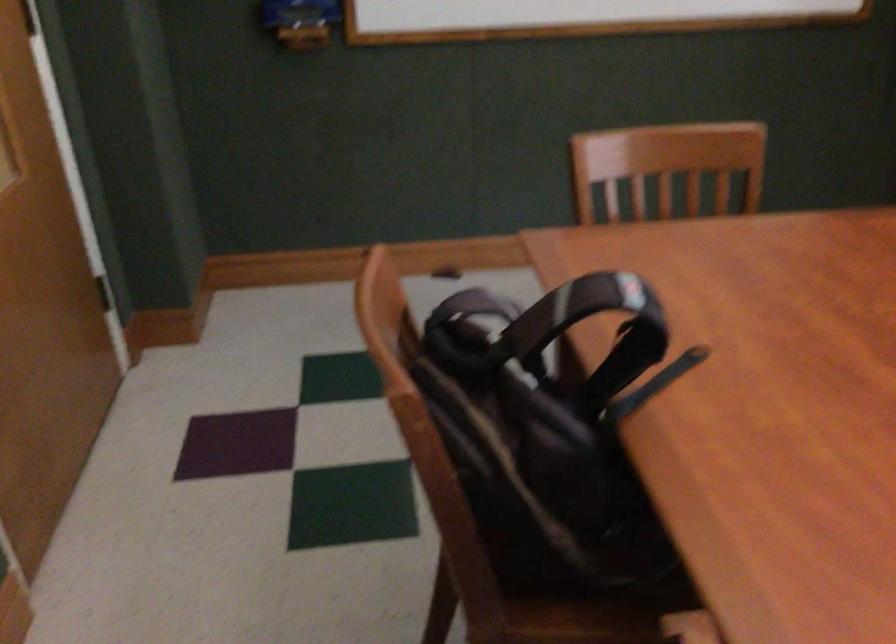
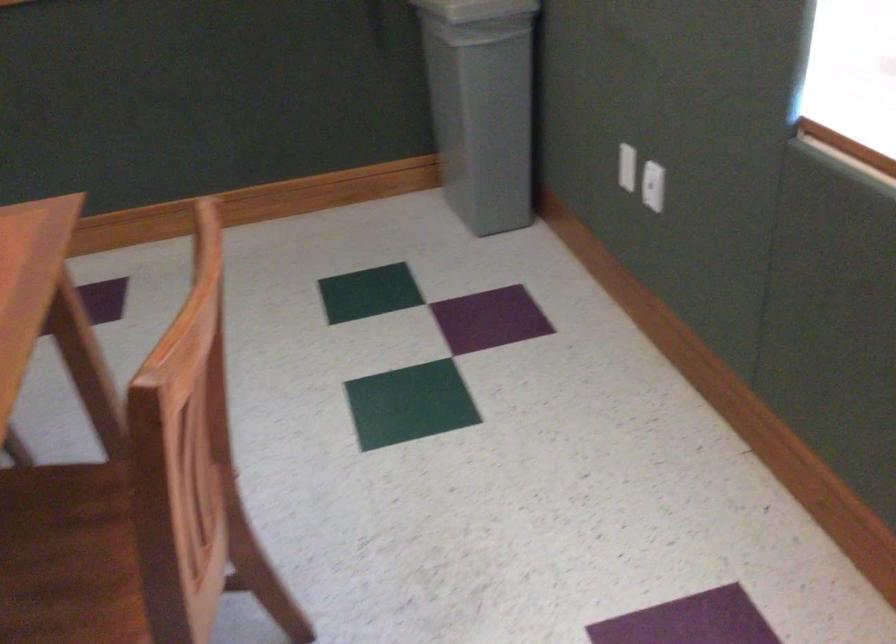
Question: Which direction would the cameraman need to move to produce the second image? Reply with the corresponding letter.

Choices:
 (A) Left
 (B) Right
 (C) Forward
 (D) Backward

Answer: (B)